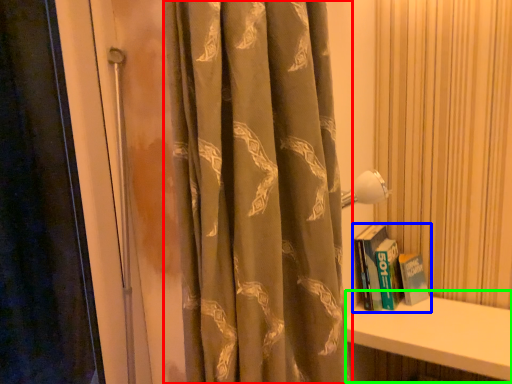
Question: Considering the real-world distances, which object is closest to curtain (highlighted by a red box)? book (highlighted by a blue box) or window sill (highlighted by a green box).

Choices:
 (A) book
 (B) window sill

Answer: (B)